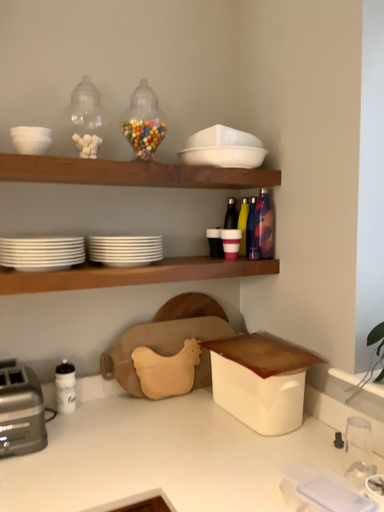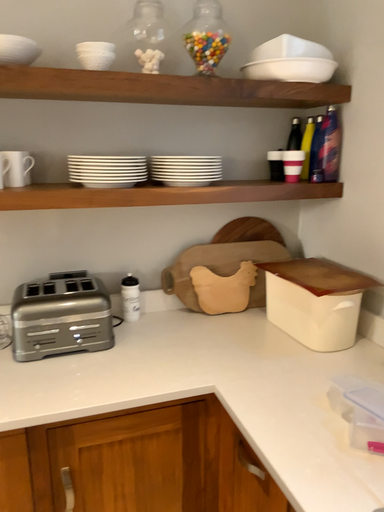
Question: How did the camera likely rotate when shooting the video?

Choices:
 (A) rotated upward
 (B) rotated downward

Answer: (B)